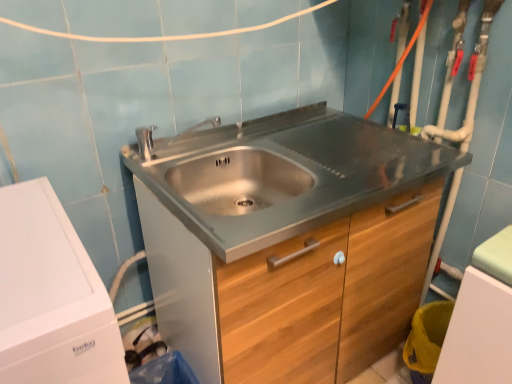
Locate an element on the screen. This screenshot has width=512, height=384. empty space that is ontop of white matte washing machine at left (from a real-world perspective) is located at coordinates (34, 244).